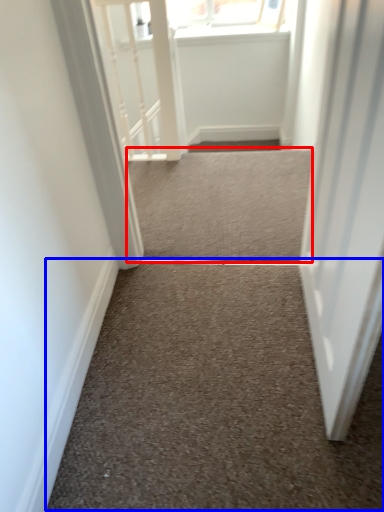
Question: Which object is closer to the camera taking this photo, stairwell (highlighted by a red box) or stairwell (highlighted by a blue box)?

Choices:
 (A) stairwell
 (B) stairwell

Answer: (B)